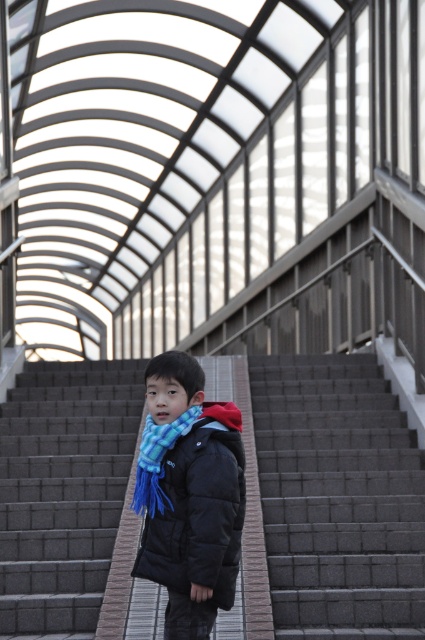
Can you confirm if gray concrete stairs at center is positioned to the right of blue plaid scarf at center?

Yes, gray concrete stairs at center is to the right of blue plaid scarf at center.

Measure the distance from gray concrete stairs at center to blue plaid scarf at center.

The distance of gray concrete stairs at center from blue plaid scarf at center is 2.52 meters.

Is point (368, 401) less distant than point (133, 496)?

No, (368, 401) is further to viewer.

Locate an element on the screen. gray concrete stairs at center is located at coordinates point(337,499).

Which of these two, black puffy jacket at center or blue plaid scarf at center, stands shorter?

blue plaid scarf at center

Is point (204, 566) farther from viewer compared to point (147, 481)?

No, it is in front of (147, 481).

This screenshot has height=640, width=425. In order to click on black puffy jacket at center in this screenshot , I will do `click(200, 509)`.

Can you confirm if gray concrete stairs at center is positioned to the left of black puffy jacket at center?

In fact, gray concrete stairs at center is to the right of black puffy jacket at center.

Is gray concrete stairs at center taller than black puffy jacket at center?

No, gray concrete stairs at center is not taller than black puffy jacket at center.

Who is more forward, (354, 353) or (207, 547)?

Point (207, 547) is more forward.

The image size is (425, 640). What are the coordinates of `gray concrete stairs at center` in the screenshot? It's located at (337, 499).